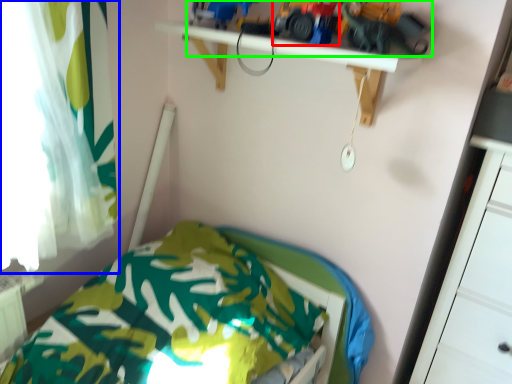
Question: Which is nearer to the toy car (highlighted by a red box)? curtain (highlighted by a blue box) or toy (highlighted by a green box).

Choices:
 (A) curtain
 (B) toy

Answer: (B)